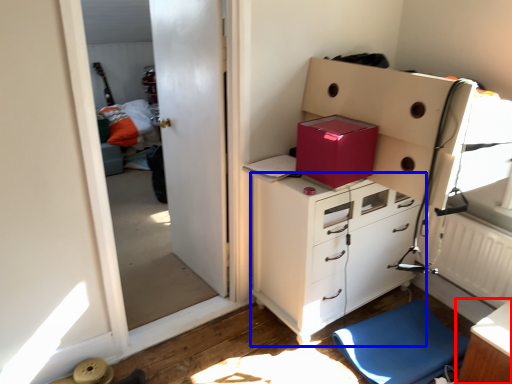
Question: Which object appears farthest to the camera in this image, table (highlighted by a red box) or chest of drawers (highlighted by a blue box)?

Choices:
 (A) table
 (B) chest of drawers

Answer: (B)